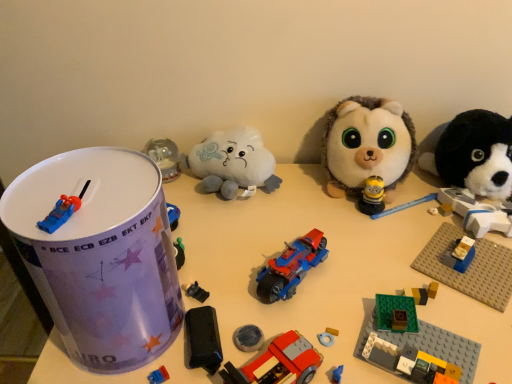
Question: Considering the relative sizes of brick-patterned plastic car at center, acting as the 5th toy starting from the left, and blue plastic car at top left, positioned as the 9th toy in right-to-left order, in the image provided, is brick-patterned plastic car at center, acting as the 5th toy starting from the left, shorter than blue plastic car at top left, positioned as the 9th toy in right-to-left order,?

Choices:
 (A) yes
 (B) no

Answer: (B)

Question: Considering the relative positions of brick-patterned plastic car at center, which is the 5th toy from right to left, and blue plastic car at top left, positioned as the 9th toy in right-to-left order, in the image provided, is brick-patterned plastic car at center, which is the 5th toy from right to left, in front of blue plastic car at top left, positioned as the 9th toy in right-to-left order,?

Choices:
 (A) yes
 (B) no

Answer: (B)

Question: Considering the relative positions of brick-patterned plastic car at center, acting as the 5th toy starting from the left, and blue plastic car at top left, positioned as the 9th toy in right-to-left order, in the image provided, is brick-patterned plastic car at center, acting as the 5th toy starting from the left, behind blue plastic car at top left, positioned as the 9th toy in right-to-left order,?

Choices:
 (A) yes
 (B) no

Answer: (A)

Question: From a real-world perspective, is brick-patterned plastic car at center, which is the 5th toy from right to left, located higher than blue plastic car at top left, positioned as the 9th toy in right-to-left order?

Choices:
 (A) no
 (B) yes

Answer: (A)

Question: From the image's perspective, is brick-patterned plastic car at center, acting as the 5th toy starting from the left, above blue plastic car at top left, positioned as the 9th toy in right-to-left order?

Choices:
 (A) no
 (B) yes

Answer: (A)

Question: From a real-world perspective, is shiny plastic motorcycle at center, which is the sixth toy in left-to-right order, positioned above or below fluffy white plush at center, the 8th toy when ordered from left to right?

Choices:
 (A) below
 (B) above

Answer: (A)

Question: Looking at their shapes, would you say shiny plastic motorcycle at center, which is the sixth toy in left-to-right order, is wider or thinner than fluffy white plush at center, the 8th toy when ordered from left to right?

Choices:
 (A) thin
 (B) wide

Answer: (A)

Question: Considering the positions of shiny plastic motorcycle at center, the 4th toy viewed from the right, and fluffy white plush at center, the 2th toy viewed from the right, in the image, is shiny plastic motorcycle at center, the 4th toy viewed from the right, taller or shorter than fluffy white plush at center, the 2th toy viewed from the right,?

Choices:
 (A) tall
 (B) short

Answer: (B)

Question: Considering the positions of point (269, 283) and point (333, 193), is point (269, 283) closer or farther from the camera than point (333, 193)?

Choices:
 (A) closer
 (B) farther

Answer: (A)

Question: Considering the positions of blue plastic car at top left, marked as the 1th toy in a left-to-right arrangement, and black plastic toy car at center, placed as the fourth toy when sorted from left to right, in the image, is blue plastic car at top left, marked as the 1th toy in a left-to-right arrangement, bigger or smaller than black plastic toy car at center, placed as the fourth toy when sorted from left to right,?

Choices:
 (A) big
 (B) small

Answer: (A)

Question: Is blue plastic car at top left, positioned as the 9th toy in right-to-left order, taller or shorter than black plastic toy car at center, placed as the fourth toy when sorted from left to right?

Choices:
 (A) tall
 (B) short

Answer: (A)

Question: Relative to black plastic toy car at center, placed as the fourth toy when sorted from left to right, is blue plastic car at top left, positioned as the 9th toy in right-to-left order, in front or behind?

Choices:
 (A) behind
 (B) front

Answer: (B)

Question: From a real-world perspective, is blue plastic car at top left, positioned as the 9th toy in right-to-left order, physically located above or below black plastic toy car at center, which is the 6th toy in right-to-left order?

Choices:
 (A) below
 (B) above

Answer: (B)

Question: Would you say white plush cloud at center, which appears as the seventh toy when viewed from the right, is to the left or to the right of brick-patterned plastic car at center, which is the 5th toy from right to left, in the picture?

Choices:
 (A) left
 (B) right

Answer: (A)

Question: From the image's perspective, relative to brick-patterned plastic car at center, acting as the 5th toy starting from the left, is white plush cloud at center, which is the third toy in left-to-right order, above or below?

Choices:
 (A) below
 (B) above

Answer: (B)